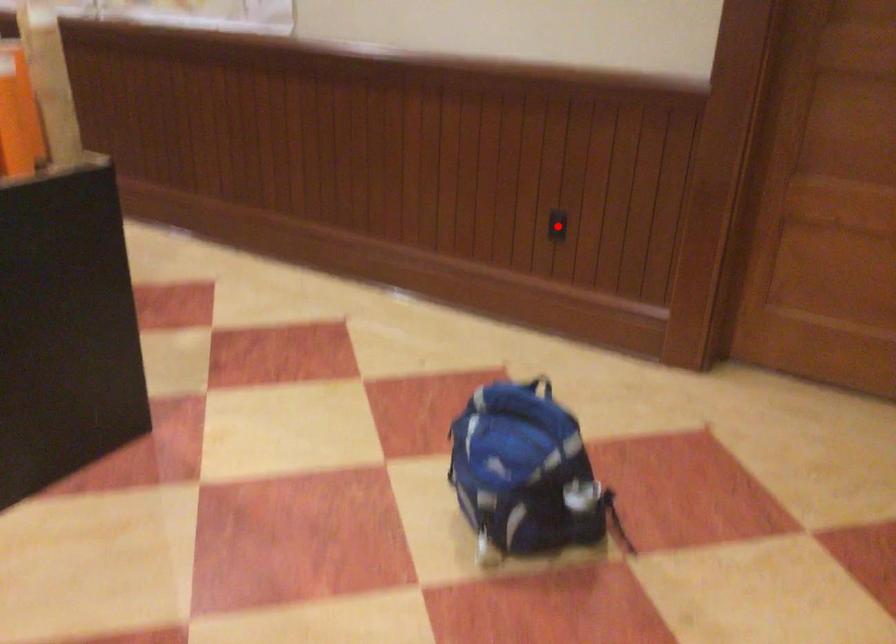
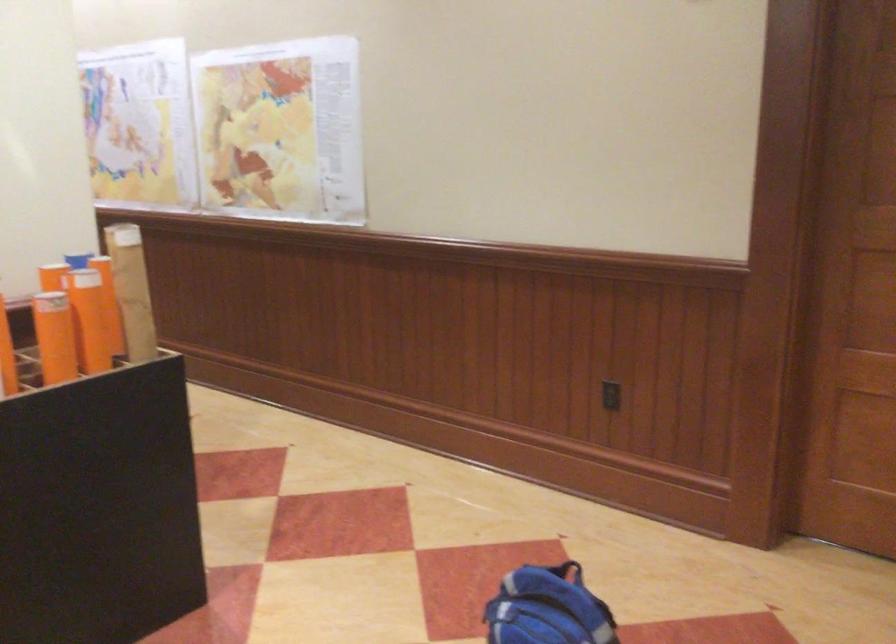
The point at the highlighted location is marked in the first image. Where is the corresponding point in the second image?

(609, 395)